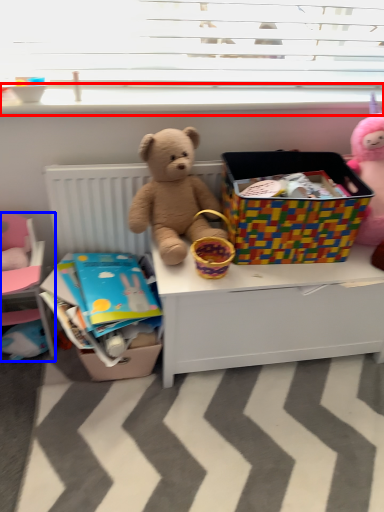
Question: Which point is closer to the camera, window sill (highlighted by a red box) or bed (highlighted by a blue box)?

Choices:
 (A) window sill
 (B) bed

Answer: (B)